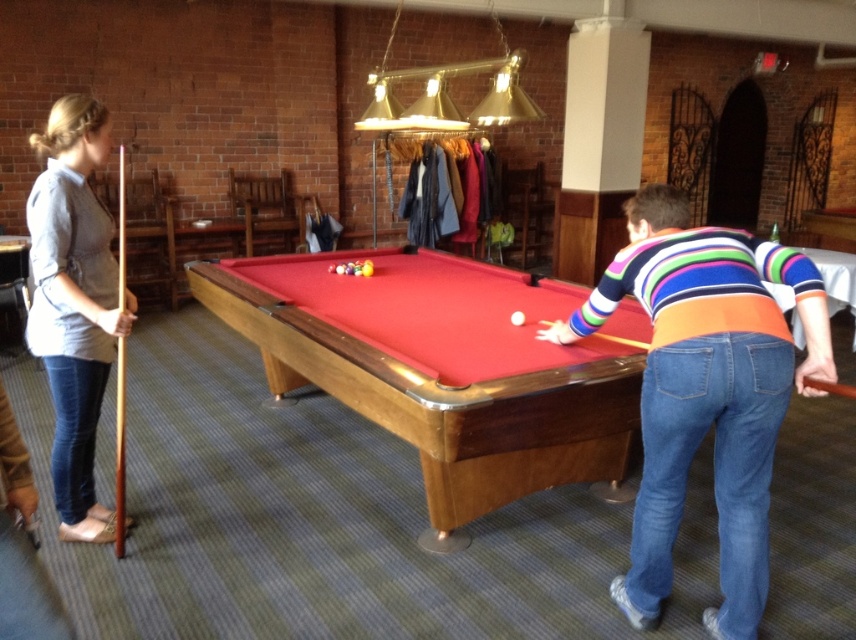
Question: Is striped sweater at center below orange fabric cue at center?

Choices:
 (A) no
 (B) yes

Answer: (B)

Question: Is striped sweater at center bigger than wooden cue stick at left?

Choices:
 (A) yes
 (B) no

Answer: (A)

Question: Which of the following is the farthest from the observer?

Choices:
 (A) wooden cue stick at left
 (B) striped sweater at center
 (C) wooden pool table at center
 (D) matte gray shirt at left

Answer: (A)

Question: Among these points, which one is farthest from the camera?

Choices:
 (A) (544, 333)
 (B) (58, 316)
 (C) (123, 353)

Answer: (A)

Question: Which point is farther to the camera?

Choices:
 (A) wooden pool table at center
 (B) matte gray shirt at left
 (C) orange fabric cue at center

Answer: (C)

Question: Does striped sweater at center appear on the left side of wooden cue stick at left?

Choices:
 (A) no
 (B) yes

Answer: (A)